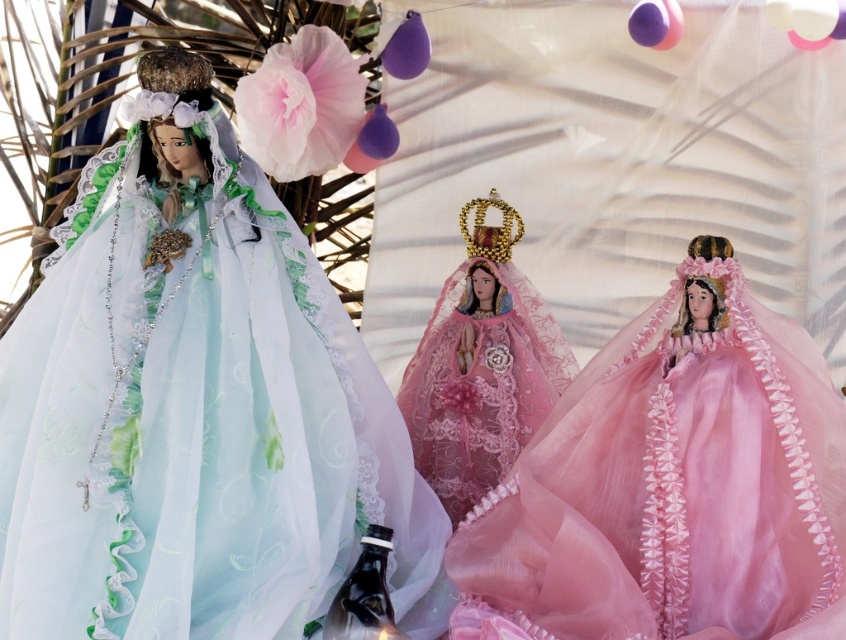
Question: Is pink tulle dress at center smaller than pink lace dress at center?

Choices:
 (A) yes
 (B) no

Answer: (B)

Question: Does matte green tulle dress at left have a smaller size compared to pink tulle dress at center?

Choices:
 (A) yes
 (B) no

Answer: (B)

Question: Which point is farther to the camera?

Choices:
 (A) (573, 627)
 (B) (509, 449)
 (C) (117, 627)

Answer: (B)

Question: Is matte green tulle dress at left wider than pink tulle dress at center?

Choices:
 (A) yes
 (B) no

Answer: (A)

Question: Which point is closer to the camera?

Choices:
 (A) (69, 336)
 (B) (595, 388)
 (C) (515, 316)

Answer: (A)

Question: Which point is farther to the camera?

Choices:
 (A) pink lace dress at center
 (B) matte green tulle dress at left

Answer: (A)